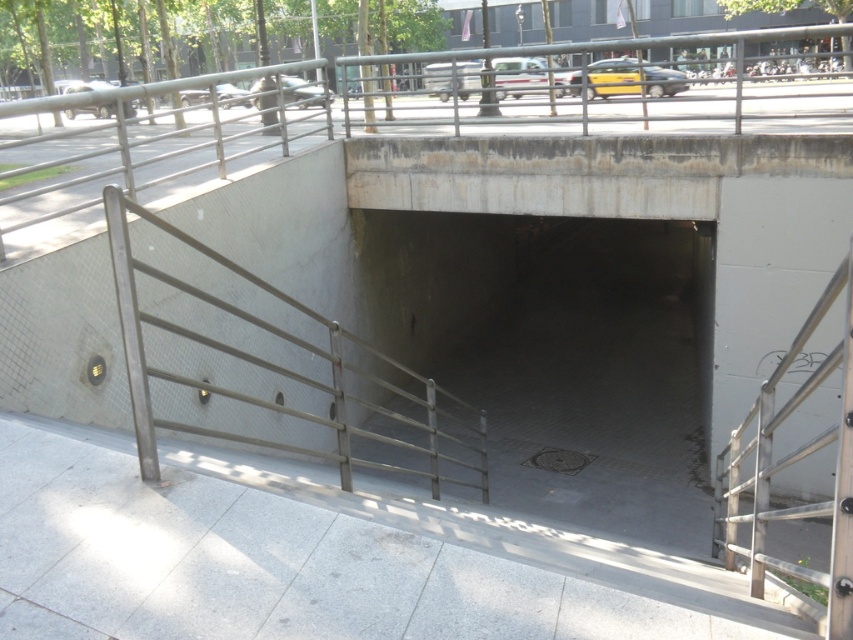
Question: Is concrete tunnel at center bigger than metallic gray railing at center?

Choices:
 (A) yes
 (B) no

Answer: (A)

Question: Which point is closer to the camera?

Choices:
 (A) (201, 612)
 (B) (691, 496)

Answer: (A)

Question: Does white tile pavement at lower center lie in front of concrete tunnel at center?

Choices:
 (A) no
 (B) yes

Answer: (B)

Question: Which point appears farthest from the camera in this image?

Choices:
 (A) (482, 412)
 (B) (666, 396)
 (C) (775, 416)
 (D) (625, 550)

Answer: (B)

Question: Which point is closer to the camera?

Choices:
 (A) white tile pavement at lower center
 (B) concrete tunnel at center

Answer: (A)

Question: Does concrete tunnel at center lie behind metallic silver railing at right?

Choices:
 (A) no
 (B) yes

Answer: (B)